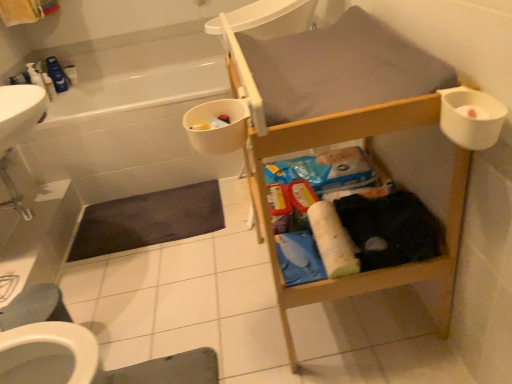
Question: From a real-world perspective, is dark matte bath mat at lower left, the first bath mat when ordered from top to bottom, above or below white plastic bidet at lower left?

Choices:
 (A) below
 (B) above

Answer: (A)

Question: Considering the positions of point (122, 240) and point (14, 364), is point (122, 240) closer or farther from the camera than point (14, 364)?

Choices:
 (A) closer
 (B) farther

Answer: (B)

Question: Which object is positioned farthest from the matte plastic toiletries at center, which appears as the 3th toiletry when viewed from the back?

Choices:
 (A) white plastic bidet at lower left
 (B) white plastic cup at upper right
 (C) dark matte bath mat at lower left, the first bath mat when ordered from top to bottom
 (D) blue plastic container at upper left, which is the second toiletry from front to back
 (E) blue glossy bottle at upper left

Answer: (E)

Question: Estimate the real-world distances between objects in this image. Which object is closer to the gray fabric bath mat at lower center, placed as the second bath mat when sorted from back to front?

Choices:
 (A) white glossy bathtub at upper left
 (B) blue glossy bottle at upper left
 (C) white plastic container at upper left, which appears as the third toiletry when viewed from the front
 (D) white plastic bidet at lower left
 (E) matte plastic toiletries at center, arranged as the 1th toiletry when viewed from the right

Answer: (D)